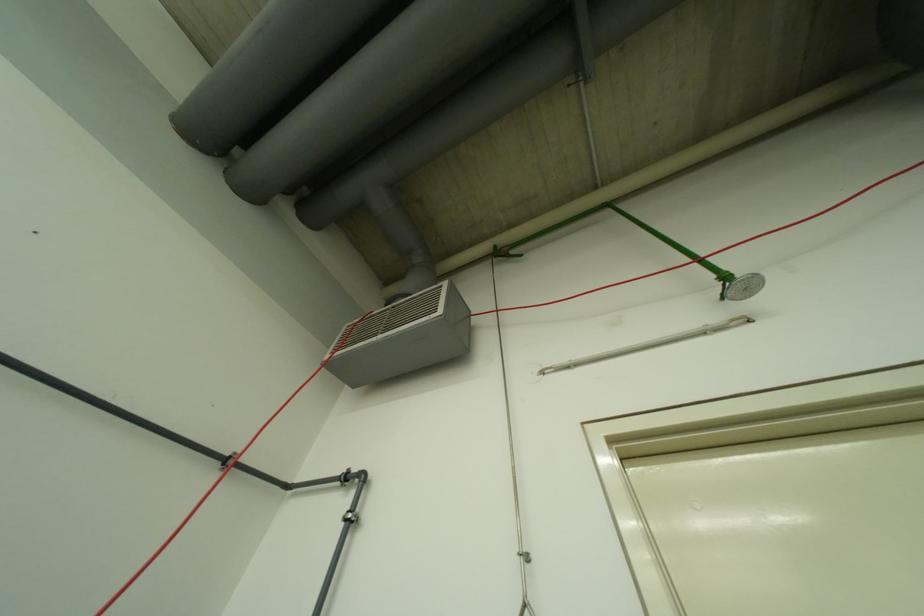
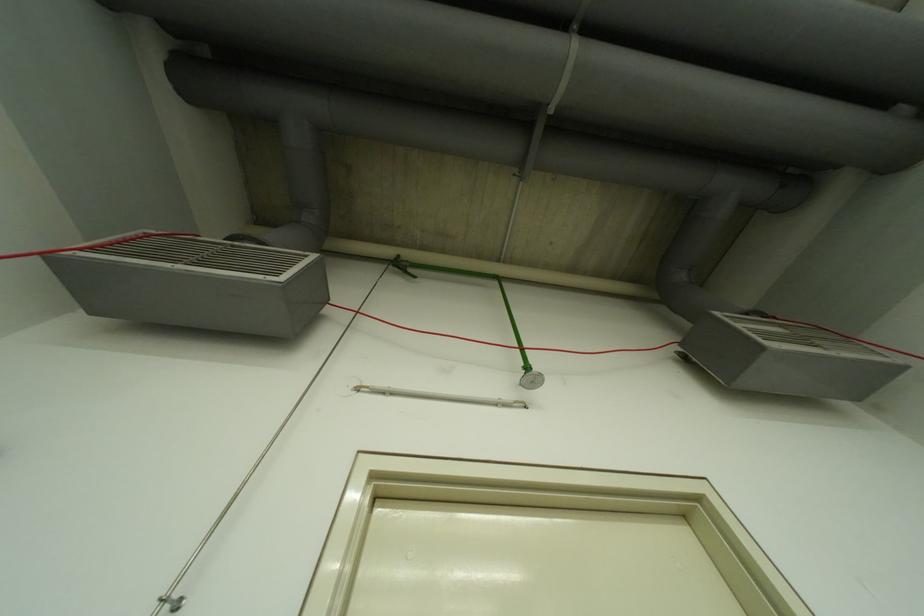
Question: The images are taken continuously from a first-person perspective. In which direction is your viewpoint rotating?

Choices:
 (A) Left
 (B) Right
 (C) Up
 (D) Down

Answer: (B)